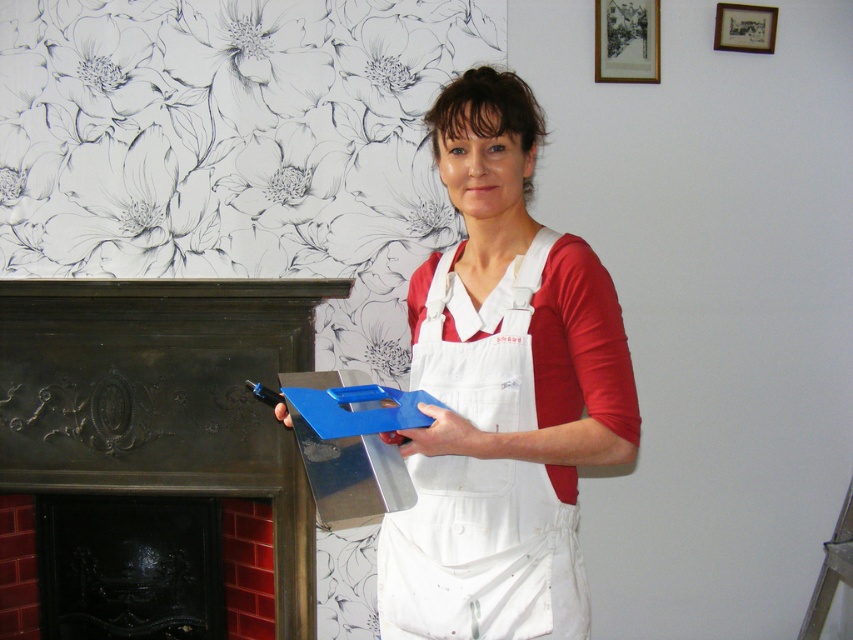
You are a delivery person who just arrived at the scene. You need to place a package that is 4 feet long on the floor between the dark brown polished wood fireplace at left and the blue plastic trowel at center. Is there enough space?

The dark brown polished wood fireplace at left is 3.39 feet away from the blue plastic trowel at center. Since the package is 4 feet long, which is longer than the available space between them, the package cannot be placed there.

You are a tailor working in a room with a floral patterned wall and a fireplace. You need to place both the white cotton apron at center and the blue plastic trowel at center onto a shelf that can only hold one of them. Which item should you choose to fit on the shelf?

The white cotton apron at center has a larger size compared to blue plastic trowel at center, so the blue plastic trowel at center would fit on the shelf since it is smaller.